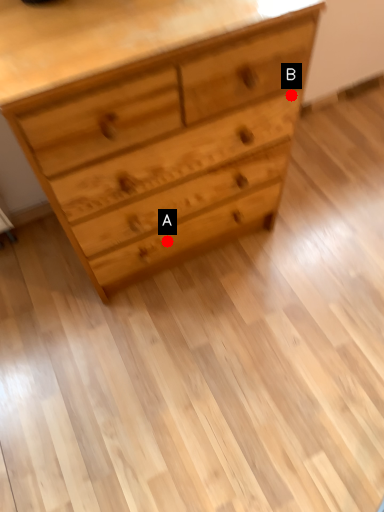
Question: Two points are circled on the image, labeled by A and B beside each circle. Among these points, which one is farthest from the camera?

Choices:
 (A) A is further
 (B) B is further

Answer: (A)